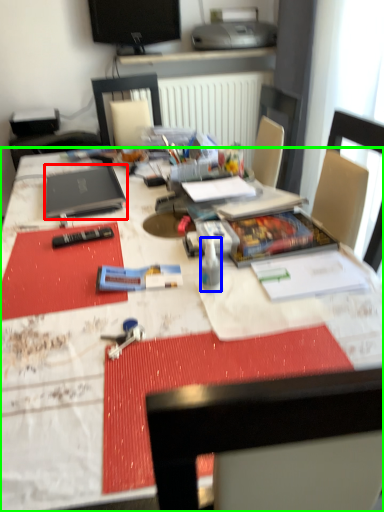
Question: Which object is positioned farthest from laptop (highlighted by a red box)? Select from bottle (highlighted by a blue box) and desk (highlighted by a green box).

Choices:
 (A) bottle
 (B) desk

Answer: (A)